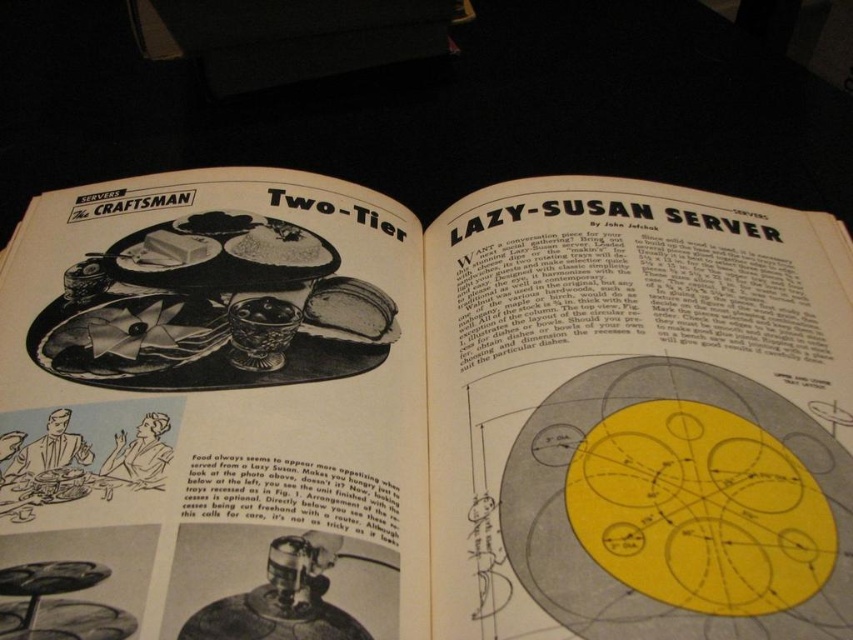
Question: Which of the following is the farthest from the observer?

Choices:
 (A) click(695, 522)
 (B) click(500, 337)

Answer: (B)

Question: Does yellow paper lazy susan server at upper right have a smaller size compared to yellow paper circle at center?

Choices:
 (A) no
 (B) yes

Answer: (A)

Question: Which of the following is the closest to the observer?

Choices:
 (A) (509, 296)
 (B) (660, 452)

Answer: (B)

Question: Is yellow paper lazy susan server at upper right to the left of yellow paper circle at center from the viewer's perspective?

Choices:
 (A) yes
 (B) no

Answer: (A)

Question: Can you confirm if yellow paper lazy susan server at upper right is positioned below yellow paper circle at center?

Choices:
 (A) yes
 (B) no

Answer: (B)